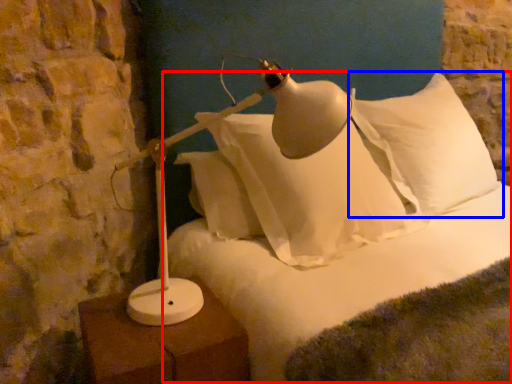
Question: Which point is closer to the camera, bed (highlighted by a red box) or pillow (highlighted by a blue box)?

Choices:
 (A) bed
 (B) pillow

Answer: (A)